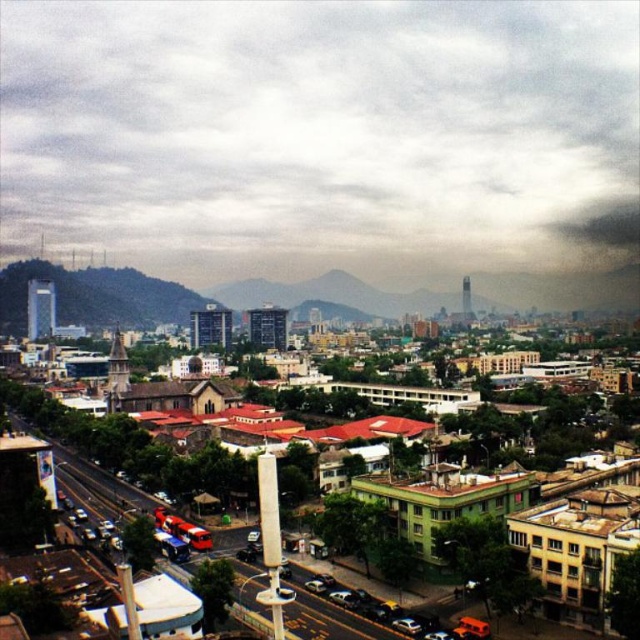
Between brown textured building at lower left and silver metallic car at lower center, which one appears on the right side from the viewer's perspective?

silver metallic car at lower center

Is brown textured building at lower left shorter than silver metallic car at lower center?

No.

At what (x,y) coordinates should I click in order to perform the action: click on brown textured building at lower left. Please return your answer as a coordinate pair (x, y). The image size is (640, 640). Looking at the image, I should click on (333, 620).

Where is `brown textured building at lower left`? The width and height of the screenshot is (640, 640). brown textured building at lower left is located at coordinates (333, 620).

Which is behind, point (248, 161) or point (340, 625)?

Point (248, 161)

Measure the distance between cloudy sky at upper center and camera.

cloudy sky at upper center and camera are 558.51 meters apart from each other.

Describe the element at coordinates (321, 134) in the screenshot. I see `cloudy sky at upper center` at that location.

Locate an element on the screen. The image size is (640, 640). cloudy sky at upper center is located at coordinates (321, 134).

Is cloudy sky at upper center to the left of silver metallic car at lower center from the viewer's perspective?

Correct, you'll find cloudy sky at upper center to the left of silver metallic car at lower center.

Who is positioned more to the left, cloudy sky at upper center or silver metallic car at lower center?

cloudy sky at upper center is more to the left.

Find the location of a particular element. This screenshot has width=640, height=640. cloudy sky at upper center is located at coordinates (321, 134).

The width and height of the screenshot is (640, 640). Identify the location of cloudy sky at upper center. pyautogui.click(x=321, y=134).